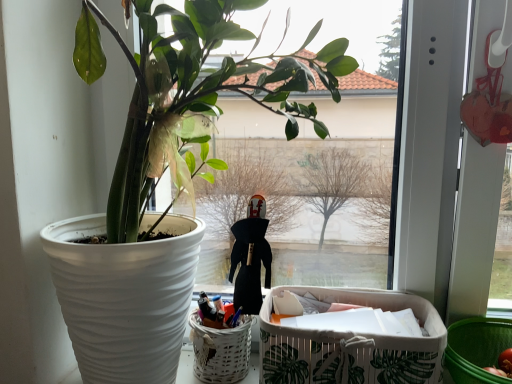
Image resolution: width=512 pixels, height=384 pixels. I want to click on green leaf-patterned fabric basket at lower right, so click(x=352, y=344).

Describe the element at coordinates (477, 349) in the screenshot. This screenshot has width=512, height=384. I see `green plastic basket at lower right` at that location.

What are the coordinates of `green leaf-patterned fabric basket at lower right` in the screenshot? It's located at click(352, 344).

The height and width of the screenshot is (384, 512). In order to click on basket above the green plastic basket at lower right (from the image's perspective) in this screenshot , I will do `click(220, 351)`.

Is white wicker basket at lower center smaller than green plastic basket at lower right?

Indeed, white wicker basket at lower center has a smaller size compared to green plastic basket at lower right.

From the image's perspective, which is below, white wicker basket at lower center or green plastic basket at lower right?

green plastic basket at lower right is shown below in the image.

How much distance is there between green plastic basket at lower right and green leaf-patterned fabric basket at lower right?

green plastic basket at lower right and green leaf-patterned fabric basket at lower right are 6.43 inches apart.

Is green plastic basket at lower right at the right side of green leaf-patterned fabric basket at lower right?

Yes.

Which is in front, green plastic basket at lower right or green leaf-patterned fabric basket at lower right?

green plastic basket at lower right is in front.

From the image's perspective, between green plastic basket at lower right and green leaf-patterned fabric basket at lower right, which one is located above?

green leaf-patterned fabric basket at lower right, from the image's perspective.

Is green plastic basket at lower right outside of white wicker basket at lower center?

green plastic basket at lower right lies outside white wicker basket at lower center's area.

How many degrees apart are the facing directions of green plastic basket at lower right and white wicker basket at lower center?

There is a 0.0011-degree angle between the facing directions of green plastic basket at lower right and white wicker basket at lower center.

Between green plastic basket at lower right and white wicker basket at lower center, which one appears on the left side from the viewer's perspective?

Positioned to the left is white wicker basket at lower center.

You are a GUI agent. You are given a task and a screenshot of the screen. Output one action in this format:
    pyautogui.click(x=<x>, y=<y>)
    Task: Click on the basket above the green plastic basket at lower right (from the image's perspective)
    
    Given the screenshot: What is the action you would take?
    pyautogui.click(x=220, y=351)

Which is behind, green matte plant at left or green leaf-patterned fabric basket at lower right?

green leaf-patterned fabric basket at lower right is further away from the camera.

Does point (314, 109) lie in front of point (364, 353)?

No.

Is green matte plant at left oriented away from green leaf-patterned fabric basket at lower right?

No, green leaf-patterned fabric basket at lower right is not at the back of green matte plant at left.

From a real-world perspective, is green matte plant at left beneath white wicker basket at lower center?

No, from a real-world perspective, green matte plant at left is not beneath white wicker basket at lower center.

How different are the orientations of green matte plant at left and white wicker basket at lower center in degrees?

There is a 0.354-degree angle between the facing directions of green matte plant at left and white wicker basket at lower center.

Relative to white wicker basket at lower center, is green matte plant at left in front or behind?

In the image, green matte plant at left appears in front of white wicker basket at lower center.

Locate an element on the screen. This screenshot has width=512, height=384. basket below the green matte plant at left (from a real-world perspective) is located at coordinates click(x=220, y=351).

Is green leaf-patterned fabric basket at lower right far from white wicker basket at lower center?

No.

Where is `shopping basket located on the right of white wicker basket at lower center`? The height and width of the screenshot is (384, 512). shopping basket located on the right of white wicker basket at lower center is located at coordinates (352, 344).

In the scene shown: From a real-world perspective, is green leaf-patterned fabric basket at lower right physically above white wicker basket at lower center?

Correct, in the physical world, green leaf-patterned fabric basket at lower right is higher than white wicker basket at lower center.

Looking at the image, does green leaf-patterned fabric basket at lower right seem bigger or smaller compared to white wicker basket at lower center?

Considering their sizes, green leaf-patterned fabric basket at lower right takes up more space than white wicker basket at lower center.

Does green matte plant at left come behind green plastic basket at lower right?

No.

In the scene shown: Can you tell me how much green matte plant at left and green plastic basket at lower right differ in facing direction?

The facing directions of green matte plant at left and green plastic basket at lower right are 0.354 degrees apart.

Could green plastic basket at lower right be considered to be inside green matte plant at left?

That's incorrect, green plastic basket at lower right is not inside green matte plant at left.

Who is taller, green matte plant at left or green plastic basket at lower right?

green matte plant at left.

Where is `basket container that appears in front of the white wicker basket at lower center`? basket container that appears in front of the white wicker basket at lower center is located at coordinates (477, 349).

You are a GUI agent. You are given a task and a screenshot of the screen. Output one action in this format:
    pyautogui.click(x=<x>, y=<y>)
    Task: Click on the basket container that appears below the green leaf-patterned fabric basket at lower right (from a real-world perspective)
    The image size is (512, 384).
    Given the screenshot: What is the action you would take?
    pyautogui.click(x=477, y=349)

Based on their spatial positions, is white wicker basket at lower center or green plastic basket at lower right further from green matte plant at left?

green plastic basket at lower right.

Which object lies nearer to the anchor point white wicker basket at lower center, green plastic basket at lower right or green leaf-patterned fabric basket at lower right?

green leaf-patterned fabric basket at lower right.

In the scene shown: When comparing their distances from green matte plant at left, does green plastic basket at lower right or white wicker basket at lower center seem closer?

white wicker basket at lower center is positioned closer to the anchor green matte plant at left.

From the image, which object appears to be nearer to white wicker basket at lower center, green matte plant at left or green plastic basket at lower right?

green matte plant at left lies closer to white wicker basket at lower center than the other object.

Based on their spatial positions, is green leaf-patterned fabric basket at lower right or green plastic basket at lower right further from white wicker basket at lower center?

green plastic basket at lower right.

When comparing their distances from green plastic basket at lower right, does green matte plant at left or white wicker basket at lower center seem closer?

Among the two, white wicker basket at lower center is located nearer to green plastic basket at lower right.

Looking at the image, which one is located further to white wicker basket at lower center, green matte plant at left or green leaf-patterned fabric basket at lower right?

green matte plant at left lies further to white wicker basket at lower center than the other object.

When comparing their distances from green leaf-patterned fabric basket at lower right, does green matte plant at left or green plastic basket at lower right seem further?

green matte plant at left is further to green leaf-patterned fabric basket at lower right.

The height and width of the screenshot is (384, 512). Identify the location of basket between green matte plant at left and green plastic basket at lower right from left to right. (220, 351).

Identify the location of shopping basket between green matte plant at left and white wicker basket at lower center from front to back. The image size is (512, 384). [352, 344].

The image size is (512, 384). What are the coordinates of `shopping basket between white wicker basket at lower center and green plastic basket at lower right from left to right` in the screenshot? It's located at (352, 344).

Find the location of `shopping basket between green matte plant at left and green plastic basket at lower right`. shopping basket between green matte plant at left and green plastic basket at lower right is located at coordinates (352, 344).